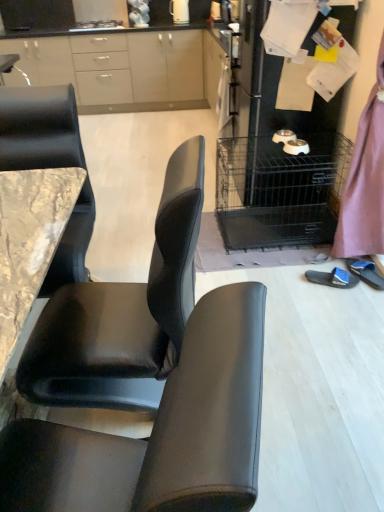
Question: Considering the positions of blue fabric slipper at lower right, which is the first footwear from right to left, and blue fabric slipper at lower right, arranged as the second footwear when viewed from the right, in the image, is blue fabric slipper at lower right, which is the first footwear from right to left, wider or thinner than blue fabric slipper at lower right, arranged as the second footwear when viewed from the right,?

Choices:
 (A) thin
 (B) wide

Answer: (A)

Question: Considering the positions of blue fabric slipper at lower right, which is the first footwear from right to left, and blue fabric slipper at lower right, arranged as the second footwear when viewed from the right, in the image, is blue fabric slipper at lower right, which is the first footwear from right to left, bigger or smaller than blue fabric slipper at lower right, arranged as the second footwear when viewed from the right,?

Choices:
 (A) small
 (B) big

Answer: (B)

Question: Estimate the real-world distances between objects in this image. Which object is farther from the matte white cabinets at upper left?

Choices:
 (A) black leather chair at center
 (B) blue fabric slipper at lower right, which is the first footwear from right to left
 (C) metallic silver pet bowls at right
 (D) white glossy electric kettle at upper center
 (E) blue fabric slipper at lower right, marked as the 1th footwear in a left-to-right arrangement

Answer: (A)

Question: Considering the real-world distances, which object is farthest from the blue fabric slipper at lower right, arranged as the second footwear when viewed from the right?

Choices:
 (A) matte white cabinets at upper left
 (B) blue fabric slipper at lower right, the 2th footwear viewed from the left
 (C) metallic silver pet bowls at right
 (D) black leather chair at center
 (E) purple satin dress at right

Answer: (A)